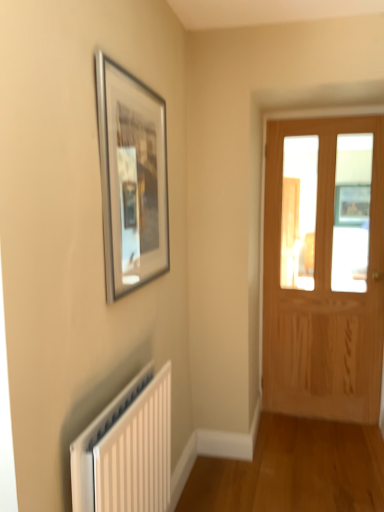
This screenshot has height=512, width=384. Identify the location of unoccupied area in front of light brown wooden door at right. (327, 451).